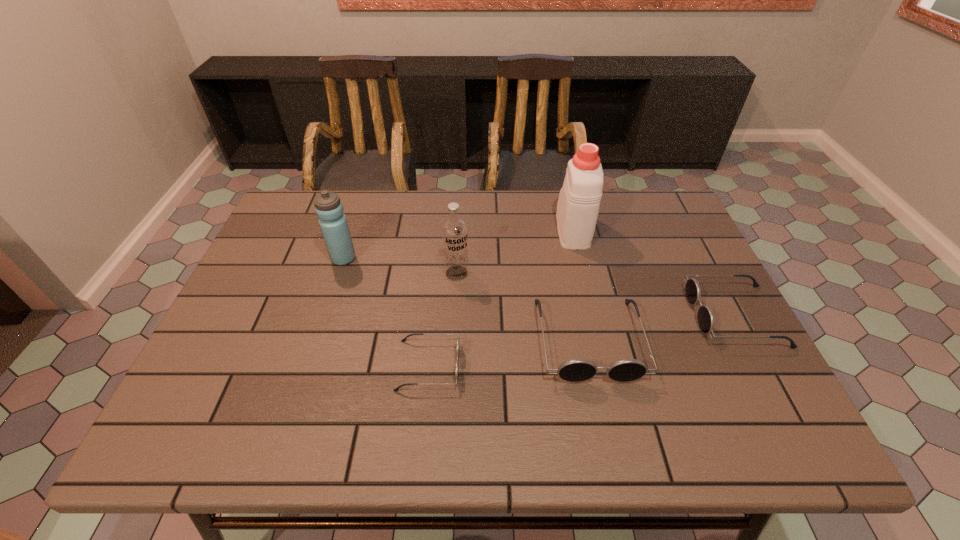
Please show where to add a sunglasses on the left while keeping spacing even. Please provide its 2D coordinates. Your answer should be formatted as a tuple, i.e. [(x, y)], where the tuple contains the x and y coordinates of a point satisfying the conditions above.

[(251, 394)]